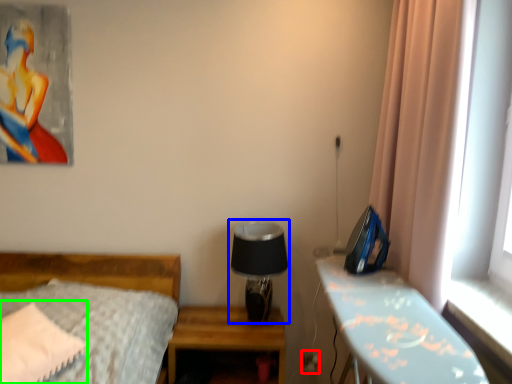
Question: Based on their relative distances, which object is nearer to electric outlet (highlighted by a red box)? Choose from table lamp (highlighted by a blue box) and pillow (highlighted by a green box).

Choices:
 (A) table lamp
 (B) pillow

Answer: (A)